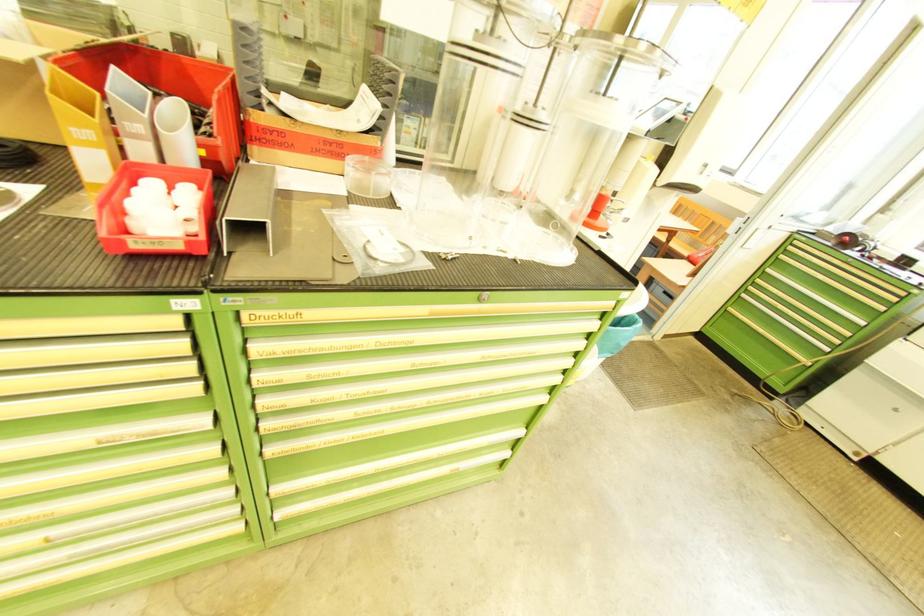
Where would you squeez the red extinguisher handle? Please return your answer as a coordinate pair (x, y).

(614, 209)